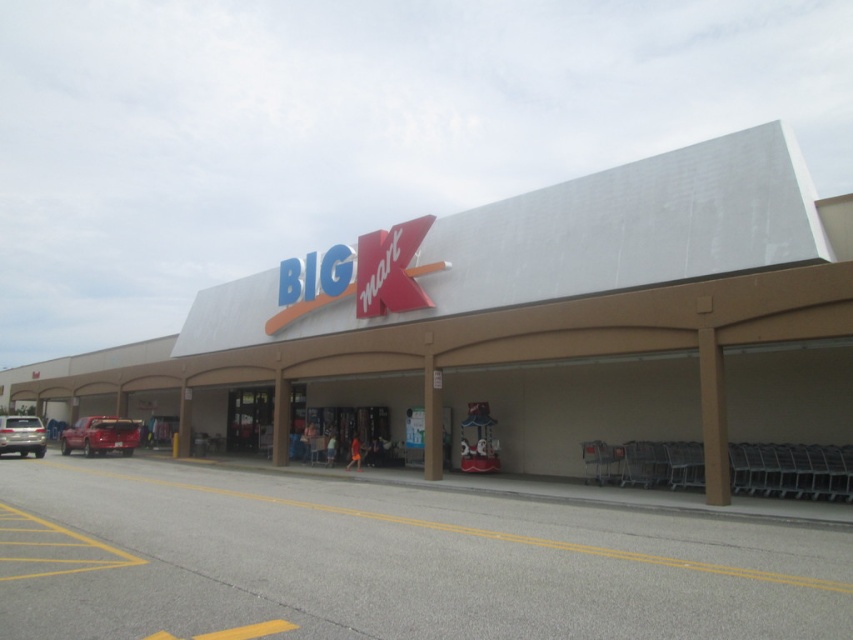
Which is above, shiny red truck at lower left or satin silver car at lower left?

satin silver car at lower left is above.

Does shiny red truck at lower left appear on the left side of satin silver car at lower left?

Yes, shiny red truck at lower left is to the left of satin silver car at lower left.

Between point (90, 420) and point (7, 451), which one is positioned in front?

Positioned in front is point (7, 451).

The width and height of the screenshot is (853, 640). I want to click on shiny red truck at lower left, so click(x=100, y=435).

Between white concrete mall at center and satin silver car at lower left, which one is positioned lower?

satin silver car at lower left is lower down.

Can you confirm if white concrete mall at center is thinner than satin silver car at lower left?

Incorrect, white concrete mall at center's width is not less than satin silver car at lower left's.

This screenshot has height=640, width=853. Identify the location of white concrete mall at center. (547, 333).

Where is `white concrete mall at center`? The width and height of the screenshot is (853, 640). white concrete mall at center is located at coordinates (547, 333).

Who is more distant from viewer, (668, 225) or (131, 451)?

Point (131, 451)

Does point (825, 346) come closer to viewer compared to point (138, 428)?

Yes, point (825, 346) is closer to viewer.

Is point (45, 369) positioned before point (61, 451)?

That is False.

This screenshot has height=640, width=853. Identify the location of white concrete mall at center. (547, 333).